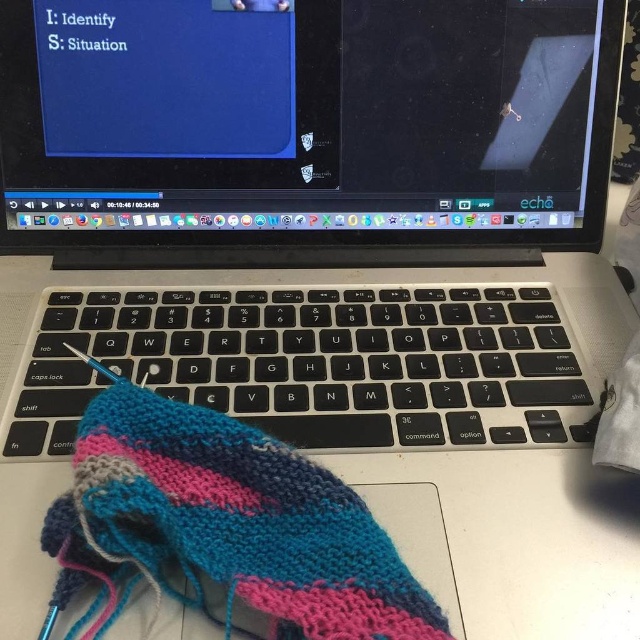
Can you confirm if satin black laptop at center is positioned to the left of black matte keyboard at center?

In fact, satin black laptop at center is to the right of black matte keyboard at center.

Is point (333, 438) in front of point (337, 326)?

Yes, it is.

Does point (352, 109) lie in front of point (355, 365)?

No.

Identify the location of satin black laptop at center. (310, 218).

Who is shorter, black matte keyboard at center or knitted woolen sock at lower left?

black matte keyboard at center

Describe the element at coordinates (316, 362) in the screenshot. This screenshot has height=640, width=640. I see `black matte keyboard at center` at that location.

Is point (300, 410) behind point (348, 506)?

Yes, point (300, 410) is farther from viewer.

You are a GUI agent. You are given a task and a screenshot of the screen. Output one action in this format:
    pyautogui.click(x=<x>, y=<y>)
    Task: Click on the black matte keyboard at center
    This screenshot has height=640, width=640.
    Given the screenshot: What is the action you would take?
    pyautogui.click(x=316, y=362)

Between satin black laptop at center and knitted woolen sock at lower left, which one has less height?

knitted woolen sock at lower left is shorter.

Is point (262, 20) in front of point (323, 566)?

That is False.

Locate an element on the screen. satin black laptop at center is located at coordinates (310, 218).